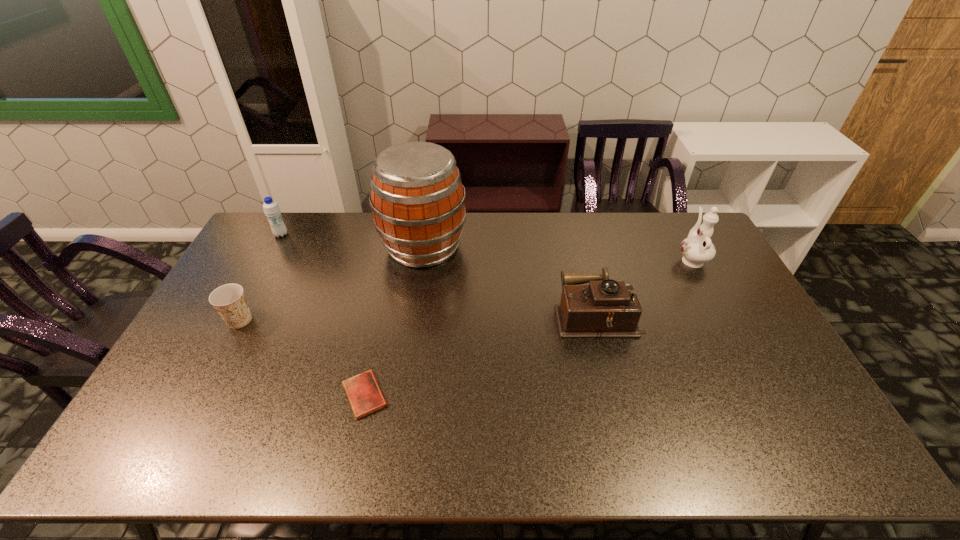
The image size is (960, 540). Find the location of `vacant space located 0.110m at the spout of the rightmost object`. vacant space located 0.110m at the spout of the rightmost object is located at coordinates (675, 228).

What are the coordinates of `vacant position located at the spout of the rightmost object` in the screenshot? It's located at (673, 225).

In order to click on free space located 0.050m on the back of the water bottle in this screenshot , I will do `click(288, 222)`.

This screenshot has width=960, height=540. Find the location of `free space located on the horn of the second object from right to left`. free space located on the horn of the second object from right to left is located at coordinates (446, 315).

Identify the location of vacant space located 0.100m on the horn of the second object from right to left. (524, 315).

Where is `free region located on the horn of the second object from right to left`? free region located on the horn of the second object from right to left is located at coordinates (430, 315).

The image size is (960, 540). I want to click on free space located 0.360m on the right of the fifth tallest object, so click(372, 320).

Where is `vacant space located 0.270m on the back of the diary`? vacant space located 0.270m on the back of the diary is located at coordinates [x=385, y=301].

This screenshot has width=960, height=540. Identify the location of cider that is at the far edge. (417, 198).

Locate an element on the screen. This screenshot has width=960, height=540. chinaware that is positioned at the far edge is located at coordinates (697, 249).